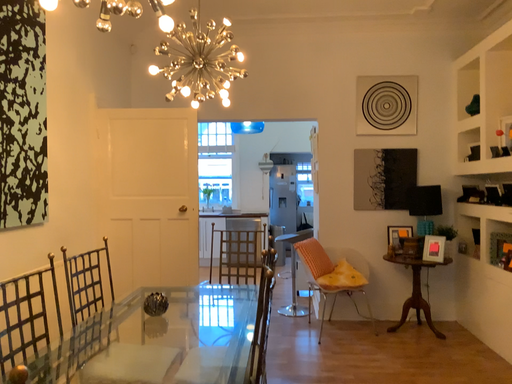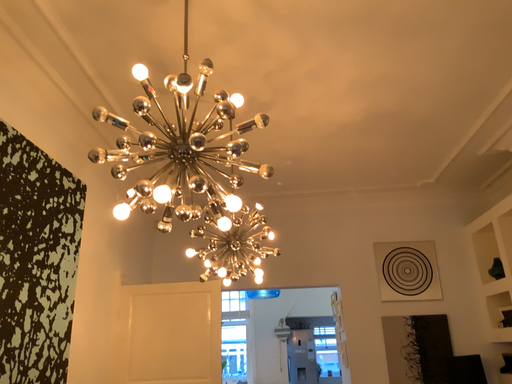
Question: How did the camera likely rotate when shooting the video?

Choices:
 (A) rotated downward
 (B) rotated upward

Answer: (B)